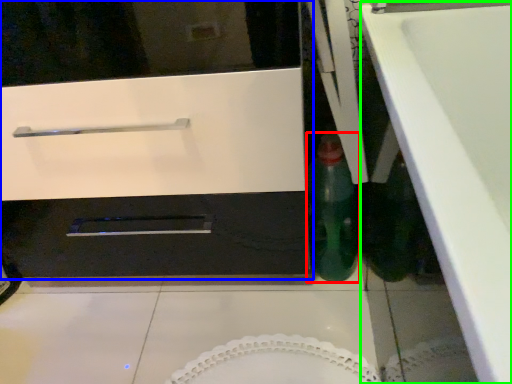
Question: Considering the real-world distances, which object is closest to bottle (highlighted by a red box)? oven (highlighted by a blue box) or counter top (highlighted by a green box).

Choices:
 (A) oven
 (B) counter top

Answer: (A)